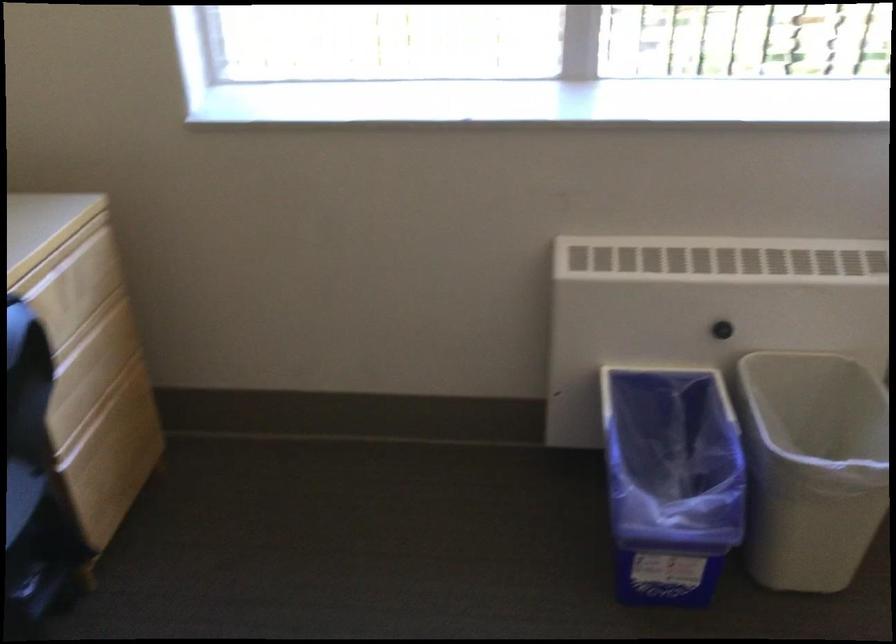
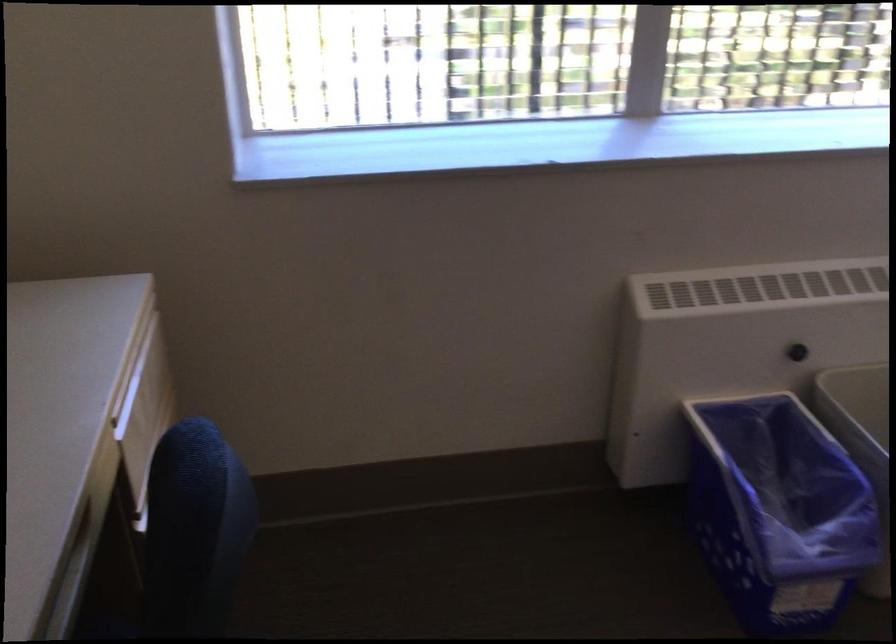
The point at (718, 328) is marked in the first image. Where is the corresponding point in the second image?

(796, 352)